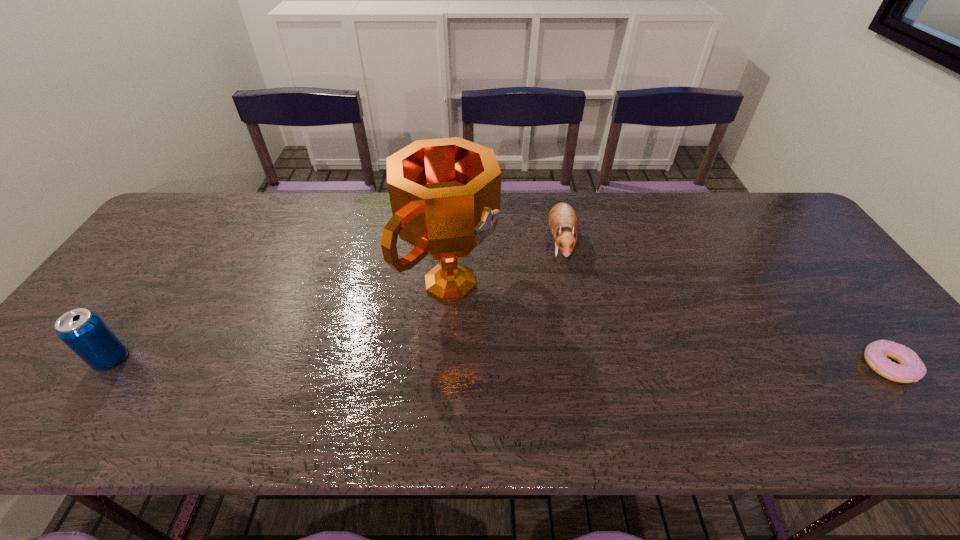
Identify the location of vacant space in between the pop soda and the award. (281, 321).

Locate an element on the screen. free point between the award and the hamster is located at coordinates (506, 262).

This screenshot has height=540, width=960. What are the coordinates of `unoccupied position between the tallest object and the leftmost object` in the screenshot? It's located at (281, 321).

I want to click on free spot between the shortest object and the hamster, so click(725, 304).

Image resolution: width=960 pixels, height=540 pixels. What are the coordinates of `free spot between the second object from left to right and the shortest object` in the screenshot? It's located at (669, 325).

Identify the location of vacant point located between the hamster and the rightmost object. 725,304.

Locate an element on the screen. Image resolution: width=960 pixels, height=540 pixels. free point between the award and the rightmost object is located at coordinates (669, 325).

Find the location of `free area in between the doughnut and the third object from left to right`. free area in between the doughnut and the third object from left to right is located at coordinates (725, 304).

You are a GUI agent. You are given a task and a screenshot of the screen. Output one action in this format:
    pyautogui.click(x=<x>, y=<y>)
    Task: Click on the object that stands as the second closest to the award
    
    Given the screenshot: What is the action you would take?
    [84, 332]

Locate which object is the second closest to the leftmost object. Please provide its 2D coordinates. Your answer should be formatted as a tuple, i.e. [(x, y)], where the tuple contains the x and y coordinates of a point satisfying the conditions above.

[(563, 222)]